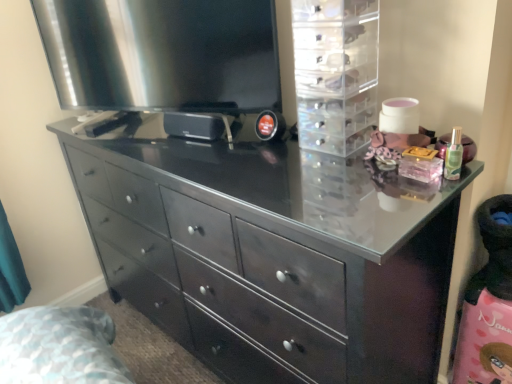
Locate an element on the screen. transparent plastic drawers at upper right is located at coordinates (335, 72).

Locate an element on the screen. Image resolution: width=512 pixels, height=384 pixels. satin black television at upper left is located at coordinates (162, 54).

Image resolution: width=512 pixels, height=384 pixels. What do you see at coordinates (272, 255) in the screenshot?
I see `black glossy chest of drawers at center` at bounding box center [272, 255].

Find the location of `transparent plastic drawers at upper right`. transparent plastic drawers at upper right is located at coordinates (335, 72).

Based on the photo, from a real-world perspective, who is located higher, satin black television at upper left or black glossy chest of drawers at center?

satin black television at upper left.

From the image's perspective, which object appears higher, satin black television at upper left or black glossy chest of drawers at center?

satin black television at upper left.

Based on the photo, does satin black television at upper left come behind black glossy chest of drawers at center?

Yes, satin black television at upper left is further from the viewer.

Which of these two, satin black television at upper left or black glossy chest of drawers at center, is wider?

black glossy chest of drawers at center is wider.

Consider the image. Is satin black television at upper left completely or partially outside of transparent plastic drawers at upper right?

satin black television at upper left is positioned outside transparent plastic drawers at upper right.

From the image's perspective, is satin black television at upper left under transparent plastic drawers at upper right?

Actually, satin black television at upper left appears above transparent plastic drawers at upper right in the image.

Is satin black television at upper left behind transparent plastic drawers at upper right?

Yes.

From the image's perspective, is transparent plastic drawers at upper right beneath black glossy chest of drawers at center?

No, from the image's perspective, transparent plastic drawers at upper right is not below black glossy chest of drawers at center.

Is transparent plastic drawers at upper right touching black glossy chest of drawers at center?

No, transparent plastic drawers at upper right is not next to black glossy chest of drawers at center.

Do you think transparent plastic drawers at upper right is within black glossy chest of drawers at center, or outside of it?

transparent plastic drawers at upper right exists outside the volume of black glossy chest of drawers at center.

Which object is positioned more to the right, transparent plastic drawers at upper right or black glossy chest of drawers at center?

transparent plastic drawers at upper right is more to the right.

Can we say black glossy chest of drawers at center lies outside satin black television at upper left?

Yes, black glossy chest of drawers at center is not within satin black television at upper left.

Does black glossy chest of drawers at center appear on the left side of satin black television at upper left?

No.

Can you confirm if black glossy chest of drawers at center is taller than satin black television at upper left?

Yes, black glossy chest of drawers at center is taller than satin black television at upper left.

From a real-world perspective, is black glossy chest of drawers at center physically below satin black television at upper left?

Yes, from a real-world perspective, black glossy chest of drawers at center is under satin black television at upper left.

Is transparent plastic drawers at upper right next to satin black television at upper left?

No, transparent plastic drawers at upper right is not touching satin black television at upper left.

From the picture: Is transparent plastic drawers at upper right completely or partially outside of satin black television at upper left?

Yes, transparent plastic drawers at upper right is not within satin black television at upper left.

Based on the photo, is transparent plastic drawers at upper right wider than satin black television at upper left?

Indeed, transparent plastic drawers at upper right has a greater width compared to satin black television at upper left.

Which of these two, black glossy chest of drawers at center or transparent plastic drawers at upper right, is smaller?

Smaller between the two is transparent plastic drawers at upper right.

This screenshot has height=384, width=512. In order to click on chest of drawers in front of the transparent plastic drawers at upper right in this screenshot , I will do `click(272, 255)`.

Is black glossy chest of drawers at center surrounding transparent plastic drawers at upper right?

That's incorrect, transparent plastic drawers at upper right is not inside black glossy chest of drawers at center.

Image resolution: width=512 pixels, height=384 pixels. There is a black glossy chest of drawers at center. Identify the location of appliance above it (from a real-world perspective). (162, 54).

This screenshot has height=384, width=512. Find the location of `appliance that is above the transparent plastic drawers at upper right (from the image's perspective)`. appliance that is above the transparent plastic drawers at upper right (from the image's perspective) is located at coordinates (162, 54).

From the image, which object appears to be nearer to transparent plastic drawers at upper right, satin black television at upper left or black glossy chest of drawers at center?

Among the two, satin black television at upper left is located nearer to transparent plastic drawers at upper right.

In the scene shown: Estimate the real-world distances between objects in this image. Which object is further from transparent plastic drawers at upper right, black glossy chest of drawers at center or satin black television at upper left?

black glossy chest of drawers at center is further to transparent plastic drawers at upper right.

In the scene shown: When comparing their distances from black glossy chest of drawers at center, does transparent plastic drawers at upper right or satin black television at upper left seem further?

satin black television at upper left is further to black glossy chest of drawers at center.

Which object lies nearer to the anchor point black glossy chest of drawers at center, satin black television at upper left or transparent plastic drawers at upper right?

transparent plastic drawers at upper right.

Estimate the real-world distances between objects in this image. Which object is further from satin black television at upper left, transparent plastic drawers at upper right or black glossy chest of drawers at center?

black glossy chest of drawers at center.

Based on their spatial positions, is black glossy chest of drawers at center or transparent plastic drawers at upper right closer to satin black television at upper left?

Based on the image, transparent plastic drawers at upper right appears to be nearer to satin black television at upper left.

Locate an element on the screen. The height and width of the screenshot is (384, 512). cabinet between satin black television at upper left and black glossy chest of drawers at center vertically is located at coordinates (335, 72).